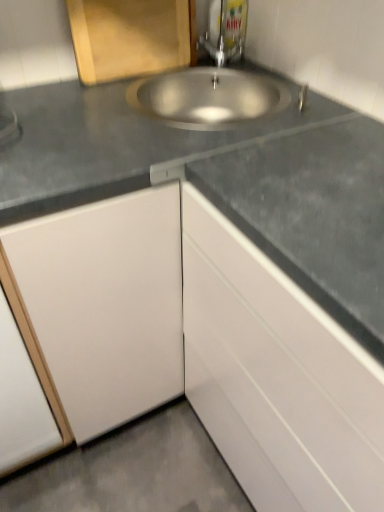
Find the location of a particular element. The height and width of the screenshot is (512, 384). white glossy cabinet at lower right, positioned as the 2th cabinetry in top-to-bottom order is located at coordinates (276, 376).

This screenshot has width=384, height=512. In order to click on wooden cutting board at upper left, placed as the first cabinetry when sorted from top to bottom in this screenshot , I will do `click(131, 37)`.

Which is farther, [217,41] or [120,38]?

Point [217,41]

Is metallic faucet at upper center further to the viewer compared to wooden cutting board at upper left, positioned as the 2th cabinetry in bottom-to-top order?

Yes, metallic faucet at upper center is further from the camera.

Considering the positions of objects metallic faucet at upper center and wooden cutting board at upper left, positioned as the 2th cabinetry in bottom-to-top order, in the image provided, who is more to the left, metallic faucet at upper center or wooden cutting board at upper left, positioned as the 2th cabinetry in bottom-to-top order,?

wooden cutting board at upper left, positioned as the 2th cabinetry in bottom-to-top order, is more to the left.

Does metallic faucet at upper center contain wooden cutting board at upper left, positioned as the 2th cabinetry in bottom-to-top order?

No, wooden cutting board at upper left, positioned as the 2th cabinetry in bottom-to-top order, is not a part of metallic faucet at upper center.

From a real-world perspective, which object stands above the other?

metallic faucet at upper center, from a real-world perspective.

Which is in front, point (334, 443) or point (216, 38)?

The point (334, 443) is closer to the camera.

Considering the sizes of objects white glossy cabinet at lower right, positioned as the 2th cabinetry in top-to-bottom order, and metallic faucet at upper center in the image provided, who is thinner, white glossy cabinet at lower right, positioned as the 2th cabinetry in top-to-bottom order, or metallic faucet at upper center?

With smaller width is metallic faucet at upper center.

Who is taller, white glossy cabinet at lower right, positioned as the 2th cabinetry in top-to-bottom order, or metallic faucet at upper center?

white glossy cabinet at lower right, positioned as the 2th cabinetry in top-to-bottom order, is taller.

Is wooden cutting board at upper left, placed as the first cabinetry when sorted from top to bottom, taller or shorter than metallic faucet at upper center?

Considering their sizes, wooden cutting board at upper left, placed as the first cabinetry when sorted from top to bottom, has less height than metallic faucet at upper center.

Measure the distance from wooden cutting board at upper left, which is the 1th cabinetry from left to right, to metallic faucet at upper center.

wooden cutting board at upper left, which is the 1th cabinetry from left to right, is 8.08 inches from metallic faucet at upper center.

Considering the positions of point (104, 75) and point (235, 54), is point (104, 75) closer or farther from the camera than point (235, 54)?

Point (104, 75) appears to be closer to the viewer than point (235, 54).

Is there a large distance between wooden cutting board at upper left, which is the 1th cabinetry from left to right, and metallic faucet at upper center?

No, wooden cutting board at upper left, which is the 1th cabinetry from left to right, is not far away from metallic faucet at upper center.

Considering the relative positions of wooden cutting board at upper left, which ranks as the second cabinetry in right-to-left order, and white glossy cabinet at lower right, arranged as the first cabinetry when viewed from the right, in the image provided, is wooden cutting board at upper left, which ranks as the second cabinetry in right-to-left order, to the left of white glossy cabinet at lower right, arranged as the first cabinetry when viewed from the right, from the viewer's perspective?

Yes.

Is wooden cutting board at upper left, which ranks as the second cabinetry in right-to-left order, wider than white glossy cabinet at lower right, positioned as the 1th cabinetry in bottom-to-top order?

No, wooden cutting board at upper left, which ranks as the second cabinetry in right-to-left order, is not wider than white glossy cabinet at lower right, positioned as the 1th cabinetry in bottom-to-top order.

Looking at the image, does wooden cutting board at upper left, placed as the first cabinetry when sorted from top to bottom, seem bigger or smaller compared to white glossy cabinet at lower right, arranged as the second cabinetry when viewed from the left?

wooden cutting board at upper left, placed as the first cabinetry when sorted from top to bottom, is smaller than white glossy cabinet at lower right, arranged as the second cabinetry when viewed from the left.

Looking at their sizes, would you say metallic faucet at upper center is wider or thinner than white glossy cabinet at lower right, positioned as the 1th cabinetry in bottom-to-top order?

Clearly, metallic faucet at upper center has less width compared to white glossy cabinet at lower right, positioned as the 1th cabinetry in bottom-to-top order.

Is metallic faucet at upper center in front of or behind white glossy cabinet at lower right, arranged as the second cabinetry when viewed from the left, in the image?

Visually, metallic faucet at upper center is located behind white glossy cabinet at lower right, arranged as the second cabinetry when viewed from the left.

Would you say metallic faucet at upper center is a long distance from white glossy cabinet at lower right, positioned as the 2th cabinetry in top-to-bottom order?

They are positioned close to each other.

Considering the sizes of metallic faucet at upper center and white glossy cabinet at lower right, arranged as the first cabinetry when viewed from the right, in the image, is metallic faucet at upper center taller or shorter than white glossy cabinet at lower right, arranged as the first cabinetry when viewed from the right,?

Considering their sizes, metallic faucet at upper center has less height than white glossy cabinet at lower right, arranged as the first cabinetry when viewed from the right.

Looking at their sizes, would you say white glossy cabinet at lower right, arranged as the second cabinetry when viewed from the left, is wider or thinner than wooden cutting board at upper left, which is the 1th cabinetry from left to right?

Clearly, white glossy cabinet at lower right, arranged as the second cabinetry when viewed from the left, has more width compared to wooden cutting board at upper left, which is the 1th cabinetry from left to right.

Are white glossy cabinet at lower right, positioned as the 1th cabinetry in bottom-to-top order, and wooden cutting board at upper left, which is the 1th cabinetry from left to right, located far from each other?

No, white glossy cabinet at lower right, positioned as the 1th cabinetry in bottom-to-top order, is not far from wooden cutting board at upper left, which is the 1th cabinetry from left to right.

Between white glossy cabinet at lower right, positioned as the 1th cabinetry in bottom-to-top order, and wooden cutting board at upper left, which is the 1th cabinetry from left to right, which one appears on the left side from the viewer's perspective?

wooden cutting board at upper left, which is the 1th cabinetry from left to right, is more to the left.

Where is `tap behind the wooden cutting board at upper left, positioned as the 2th cabinetry in bottom-to-top order`? Image resolution: width=384 pixels, height=512 pixels. tap behind the wooden cutting board at upper left, positioned as the 2th cabinetry in bottom-to-top order is located at coordinates (225, 31).

What are the coordinates of `cabinetry that is on the right side of metallic faucet at upper center` in the screenshot? It's located at (276, 376).

Looking at the image, which one is located closer to metallic faucet at upper center, white glossy cabinet at lower right, positioned as the 2th cabinetry in top-to-bottom order, or wooden cutting board at upper left, positioned as the 2th cabinetry in bottom-to-top order?

The object closer to metallic faucet at upper center is wooden cutting board at upper left, positioned as the 2th cabinetry in bottom-to-top order.

Based on their spatial positions, is metallic faucet at upper center or white glossy cabinet at lower right, positioned as the 1th cabinetry in bottom-to-top order, further from wooden cutting board at upper left, which is the 1th cabinetry from left to right?

The object further to wooden cutting board at upper left, which is the 1th cabinetry from left to right, is white glossy cabinet at lower right, positioned as the 1th cabinetry in bottom-to-top order.

From the picture: Looking at the image, which one is located closer to metallic faucet at upper center, wooden cutting board at upper left, positioned as the 2th cabinetry in bottom-to-top order, or white glossy cabinet at lower right, positioned as the 2th cabinetry in top-to-bottom order?

Based on the image, wooden cutting board at upper left, positioned as the 2th cabinetry in bottom-to-top order, appears to be nearer to metallic faucet at upper center.

Looking at the image, which one is located closer to wooden cutting board at upper left, positioned as the 2th cabinetry in bottom-to-top order, white glossy cabinet at lower right, arranged as the first cabinetry when viewed from the right, or metallic faucet at upper center?

Among the two, metallic faucet at upper center is located nearer to wooden cutting board at upper left, positioned as the 2th cabinetry in bottom-to-top order.

Estimate the real-world distances between objects in this image. Which object is closer to white glossy cabinet at lower right, arranged as the first cabinetry when viewed from the right, metallic faucet at upper center or wooden cutting board at upper left, which is the 1th cabinetry from left to right?

Among the two, wooden cutting board at upper left, which is the 1th cabinetry from left to right, is located nearer to white glossy cabinet at lower right, arranged as the first cabinetry when viewed from the right.

Considering their positions, is wooden cutting board at upper left, which is the 1th cabinetry from left to right, positioned closer to white glossy cabinet at lower right, arranged as the first cabinetry when viewed from the right, than metallic faucet at upper center?

wooden cutting board at upper left, which is the 1th cabinetry from left to right, is positioned closer to the anchor white glossy cabinet at lower right, arranged as the first cabinetry when viewed from the right.

Find the location of `cabinetry that lies between metallic faucet at upper center and white glossy cabinet at lower right, arranged as the first cabinetry when viewed from the right, from top to bottom`. cabinetry that lies between metallic faucet at upper center and white glossy cabinet at lower right, arranged as the first cabinetry when viewed from the right, from top to bottom is located at coordinates (131, 37).